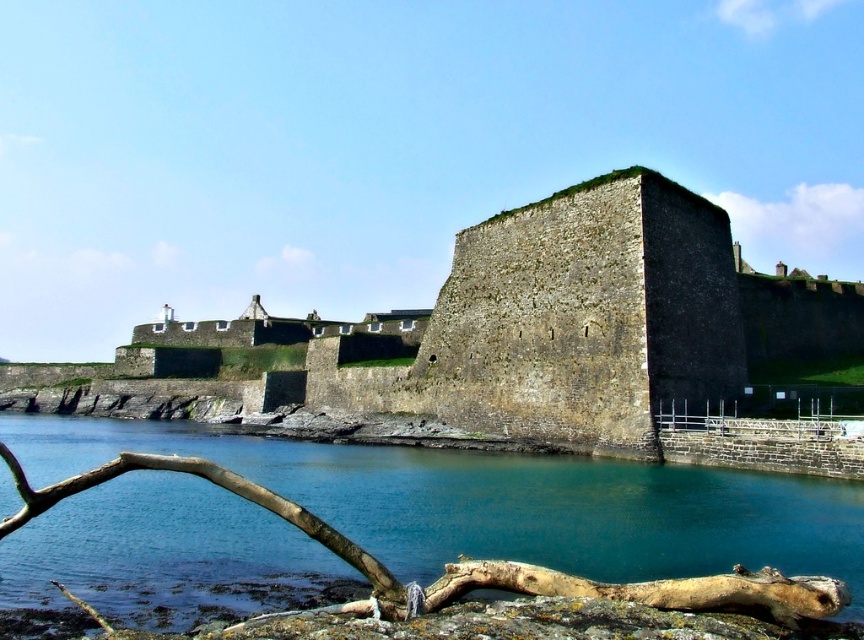
Question: Among these points, which one is farthest from the camera?

Choices:
 (A) (483, 300)
 (B) (678, 506)

Answer: (A)

Question: Can you confirm if brown stone wall at center is positioned to the left of blue water at lower left?

Choices:
 (A) yes
 (B) no

Answer: (A)

Question: Which point is closer to the camera?

Choices:
 (A) blue water at lower left
 (B) brown stone wall at center

Answer: (A)

Question: Which point is closer to the camera?

Choices:
 (A) blue water at lower left
 (B) brown stone wall at center

Answer: (A)

Question: Is brown stone wall at center positioned in front of blue water at lower left?

Choices:
 (A) no
 (B) yes

Answer: (A)

Question: Is brown stone wall at center positioned before blue water at lower left?

Choices:
 (A) no
 (B) yes

Answer: (A)